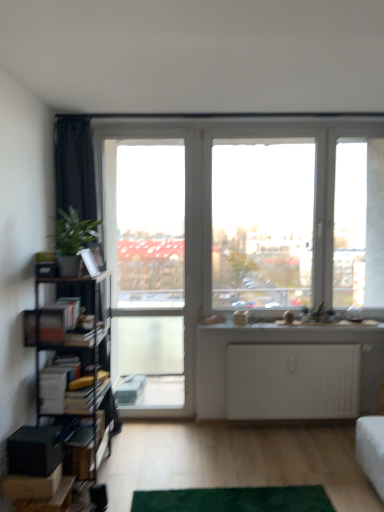
Question: Relative to hardcover books at left, the second book positioned from the top, is transparent glass window at center in front or behind?

Choices:
 (A) front
 (B) behind

Answer: (B)

Question: From their relative heights in the image, would you say transparent glass window at center is taller or shorter than hardcover books at left, the second book positioned from the top?

Choices:
 (A) short
 (B) tall

Answer: (B)

Question: Which is nearer to the hardcover books at left, the 1th book when ordered from top to bottom?

Choices:
 (A) hardcover books at left, the first book when ordered from bottom to top
 (B) clear glass screen door at center
 (C) green carpet at lower center
 (D) green leafy plant at left
 (E) metallic black bookshelf at left

Answer: (D)

Question: Which of these objects is positioned closest to the clear glass screen door at center?

Choices:
 (A) hardcover books at left, the second book positioned from the top
 (B) hardcover books at left, marked as the 2th book in a bottom-to-top arrangement
 (C) green leafy plant at left
 (D) metallic black bookshelf at left
 (E) transparent glass window at center

Answer: (D)